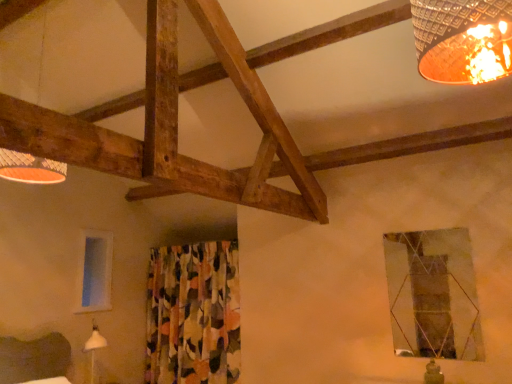
Question: Can you confirm if metallic reflective window at upper right, the 1th window in the right-to-left sequence, is smaller than matte wooden lampshade at upper left?

Choices:
 (A) no
 (B) yes

Answer: (B)

Question: Is metallic reflective window at upper right, which ranks as the 2th window in back-to-front order, thinner than matte wooden lampshade at upper left?

Choices:
 (A) no
 (B) yes

Answer: (B)

Question: Is metallic reflective window at upper right, the second window in the left-to-right sequence, far from matte wooden lampshade at upper left?

Choices:
 (A) no
 (B) yes

Answer: (B)

Question: Can we say metallic reflective window at upper right, which ranks as the 2th window in back-to-front order, lies outside matte wooden lampshade at upper left?

Choices:
 (A) no
 (B) yes

Answer: (B)

Question: From the image's perspective, is metallic reflective window at upper right, which ranks as the 2th window in back-to-front order, on top of matte wooden lampshade at upper left?

Choices:
 (A) yes
 (B) no

Answer: (B)

Question: In the image, is floral fabric curtain at center positioned in front of or behind transparent glass window at left, positioned as the second window in right-to-left order?

Choices:
 (A) behind
 (B) front

Answer: (B)

Question: Considering the positions of floral fabric curtain at center and transparent glass window at left, placed as the second window when sorted from front to back, in the image, is floral fabric curtain at center taller or shorter than transparent glass window at left, placed as the second window when sorted from front to back,?

Choices:
 (A) short
 (B) tall

Answer: (B)

Question: Would you say floral fabric curtain at center is inside or outside transparent glass window at left, the first window when ordered from back to front?

Choices:
 (A) outside
 (B) inside

Answer: (A)

Question: From the image's perspective, is floral fabric curtain at center located above or below transparent glass window at left, placed as the second window when sorted from front to back?

Choices:
 (A) above
 (B) below

Answer: (B)

Question: Considering the relative positions of metallic reflective window at upper right, the second window in the left-to-right sequence, and transparent glass window at left, the first window when ordered from back to front, in the image provided, is metallic reflective window at upper right, the second window in the left-to-right sequence, to the left or to the right of transparent glass window at left, the first window when ordered from back to front,?

Choices:
 (A) right
 (B) left

Answer: (A)

Question: Relative to transparent glass window at left, which is the first window from left to right, is metallic reflective window at upper right, the 1th window in the right-to-left sequence, in front or behind?

Choices:
 (A) behind
 (B) front

Answer: (B)

Question: In terms of height, does metallic reflective window at upper right, the second window in the left-to-right sequence, look taller or shorter compared to transparent glass window at left, the first window when ordered from back to front?

Choices:
 (A) tall
 (B) short

Answer: (A)

Question: Does point (446, 332) appear closer or farther from the camera than point (93, 311)?

Choices:
 (A) farther
 (B) closer

Answer: (B)

Question: From their relative heights in the image, would you say matte wooden lampshade at upper left is taller or shorter than floral fabric curtain at center?

Choices:
 (A) short
 (B) tall

Answer: (A)

Question: Would you say matte wooden lampshade at upper left is to the left or to the right of floral fabric curtain at center in the picture?

Choices:
 (A) right
 (B) left

Answer: (B)